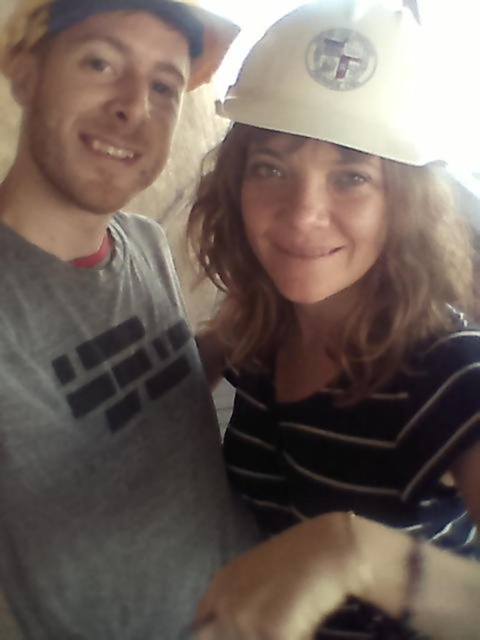
Question: Does white matte hard hat at upper right have a smaller size compared to gray matte t-shirt at left?

Choices:
 (A) yes
 (B) no

Answer: (B)

Question: Which point is closer to the camera taking this photo?

Choices:
 (A) (255, 76)
 (B) (288, 161)
 (C) (92, 624)

Answer: (B)

Question: Which is farther from the gray matte t-shirt at left?

Choices:
 (A) white matte hard hat at upper center
 (B) white matte hard hat at upper right

Answer: (A)

Question: Is white matte hard hat at upper right smaller than white matte hard hat at upper center?

Choices:
 (A) no
 (B) yes

Answer: (A)

Question: Which object appears farthest from the camera in this image?

Choices:
 (A) white matte hard hat at upper right
 (B) gray matte t-shirt at left

Answer: (B)

Question: Is white matte hard hat at upper right positioned in front of white matte hard hat at upper center?

Choices:
 (A) yes
 (B) no

Answer: (A)